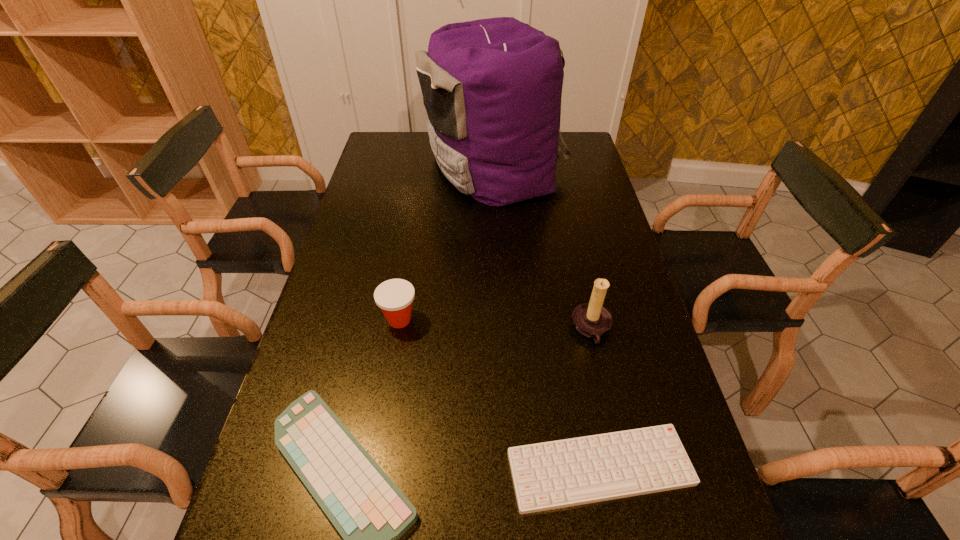
Locate an element on the screen. Image resolution: width=960 pixels, height=540 pixels. free space located 0.080m on the wick of the fourth shortest object is located at coordinates (540, 330).

Find the location of a particular element. free space located on the back of the Dixie cup is located at coordinates coord(416,224).

The width and height of the screenshot is (960, 540). Find the location of `free space located on the back of the right computer keyboard`. free space located on the back of the right computer keyboard is located at coordinates (567, 295).

I want to click on object positioned at the far edge, so click(492, 88).

Find the location of `backpack located in the right edge section of the desktop`. backpack located in the right edge section of the desktop is located at coordinates (492, 88).

Identify the location of candle holder at the right edge. pyautogui.click(x=591, y=319).

The height and width of the screenshot is (540, 960). Find the location of `computer keyboard at the right edge`. computer keyboard at the right edge is located at coordinates (550, 475).

The image size is (960, 540). What are the coordinates of `object that is at the far right corner` in the screenshot? It's located at (492, 88).

Locate an element on the screen. This screenshot has width=960, height=540. free point at the left edge is located at coordinates click(385, 255).

Locate an element on the screen. Image resolution: width=960 pixels, height=540 pixels. vacant region at the right edge of the desktop is located at coordinates (586, 253).